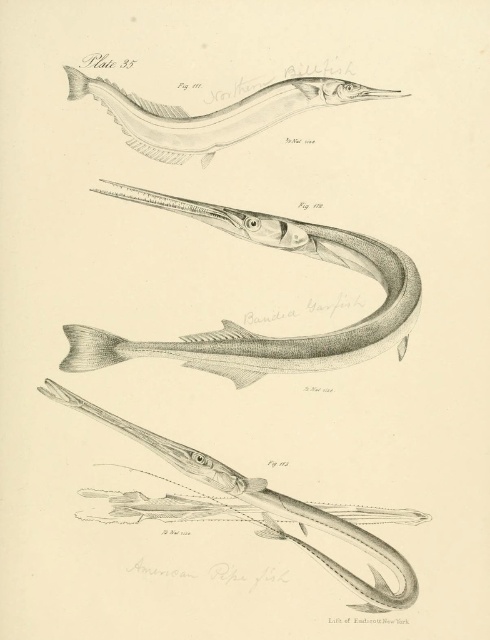
Locate an element on the screen. grayish-white pencil sketch of needlefish at upper center is located at coordinates (214, 113).

Can you confirm if grayish-white pencil sketch of needlefish at upper center is thinner than smooth silver pipefish at center?

Yes, grayish-white pencil sketch of needlefish at upper center is thinner than smooth silver pipefish at center.

Which is behind, point (147, 122) or point (305, 518)?

Positioned behind is point (147, 122).

Identify the location of grayish-white pencil sketch of needlefish at upper center. This screenshot has width=490, height=640. (214, 113).

Does point (259, 232) come farther from viewer compared to point (171, 132)?

Yes, it is.

Is smooth gray garfish at center taller than grayish-white pencil sketch of needlefish at upper center?

Yes, smooth gray garfish at center is taller than grayish-white pencil sketch of needlefish at upper center.

At what (x,y) coordinates should I click in order to perform the action: click on smooth gray garfish at center. Please return your answer as a coordinate pair (x, y). Image resolution: width=490 pixels, height=640 pixels. Looking at the image, I should click on (260, 333).

Image resolution: width=490 pixels, height=640 pixels. Find the location of `smooth gray garfish at center`. smooth gray garfish at center is located at coordinates (260, 333).

Between smooth gray garfish at center and smooth silver pipefish at center, which one is positioned lower?

smooth silver pipefish at center is below.

The image size is (490, 640). Describe the element at coordinates (260, 333) in the screenshot. I see `smooth gray garfish at center` at that location.

Identify the location of smooth gray garfish at center. (260, 333).